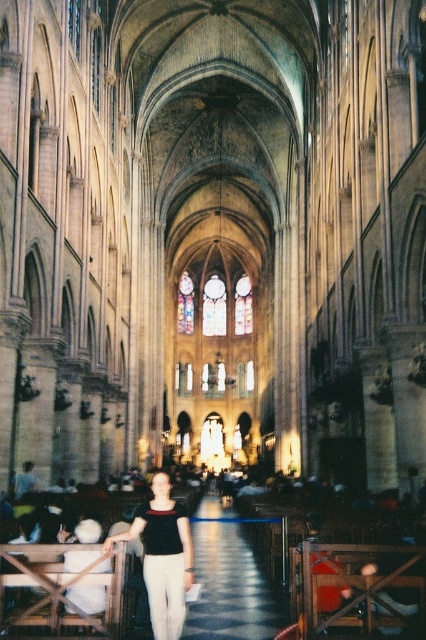
Between polished stone aisle at center and matte black blouse at center, which one appears on the right side from the viewer's perspective?

From the viewer's perspective, polished stone aisle at center appears more on the right side.

Between polished stone aisle at center and matte black blouse at center, which one is positioned lower?

Positioned lower is polished stone aisle at center.

Is point (236, 608) more distant than point (149, 561)?

That is True.

In order to click on polished stone aisle at center in this screenshot , I will do `click(229, 580)`.